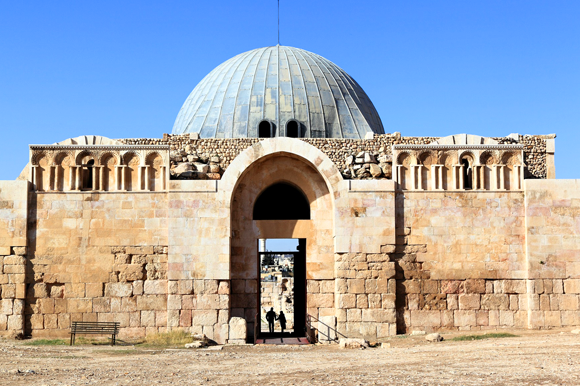
Image resolution: width=580 pixels, height=386 pixels. Find the location of `bench`. bench is located at coordinates (100, 329).